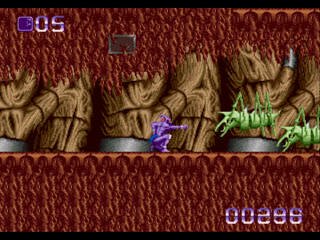
Identify the location of red lower wall. This screenshot has height=240, width=320. (12, 174), (15, 211), (81, 215), (193, 213), (184, 171), (94, 177), (296, 173), (314, 216).